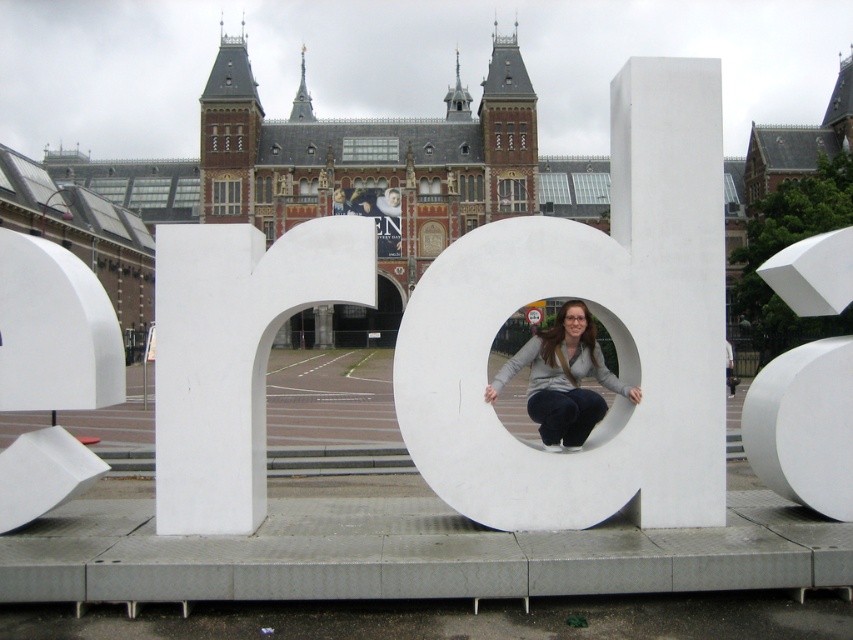
Between point (444, 490) and point (838, 339), which one is positioned in front?

Point (444, 490)

Does white matte letter at center lie in front of white matte sphere at right?

No, it is not.

You are a GUI agent. You are given a task and a screenshot of the screen. Output one action in this format:
    pyautogui.click(x=<x>, y=<y>)
    Task: Click on the white matte letter at center
    
    Given the screenshot: What is the action you would take?
    [x=599, y=317]

Where is `white matte letter at center`? white matte letter at center is located at coordinates (599, 317).

Is point (845, 516) positioned after point (631, 400)?

That is False.

Who is positioned more to the right, white matte sphere at right or matte gray sweater at center?

Positioned to the right is white matte sphere at right.

Identify the location of white matte sphere at right. The width and height of the screenshot is (853, 640). (804, 426).

Is white matte letter at center bigger than matte gray sweater at center?

Yes.

Can you confirm if white matte letter at center is positioned to the left of matte gray sweater at center?

In fact, white matte letter at center is to the right of matte gray sweater at center.

Image resolution: width=853 pixels, height=640 pixels. In order to click on white matte letter at center in this screenshot , I will do `click(599, 317)`.

Locate an element on the screen. Image resolution: width=853 pixels, height=640 pixels. white matte letter at center is located at coordinates (x=599, y=317).